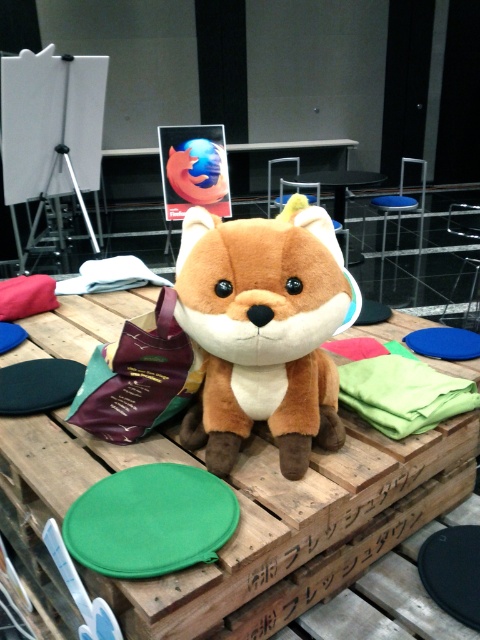
You are a photographer trying to capture the fox plush at the center of the wooden pallet. You notice two points marked in the scene at coordinates point (303, 499) and point (296, 288). Which point is closer to your camera lens?

Point (296, 288) is closer to the camera lens because it is less further than point (303, 499) which is further away.

You are setting up a display and need to place a 15cm tall figurine on the brown wooden table at center. The table has a maximum weight capacity of 5kg. Can you confirm if the table can safely hold the figurine?

The brown wooden table at center has a maximum weight capacity of 5kg, so yes, it can safely hold the figurine as long as its weight does not exceed the limit.

You are setting up a booth for an event and need to place a 12 inch wide decorative item between the brown wooden table at center and the soft plush toy at center. Can the item fit in the space between them?

The distance between the brown wooden table at center and the soft plush toy at center is 11.76 inches. Since the decorative item is 12 inches wide, it cannot fit in the space between them as the required space is slightly larger than the available gap.